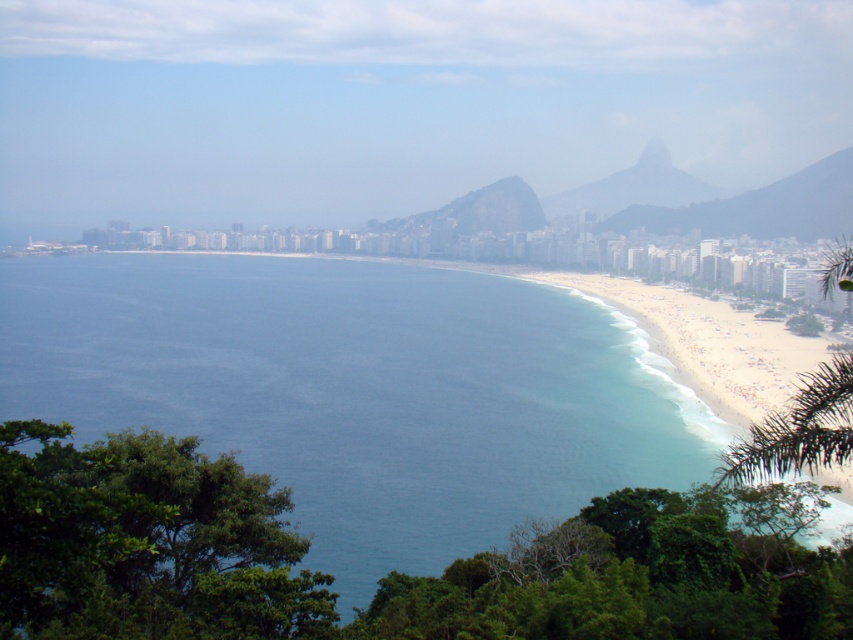
You are a photographer planning to capture the entire coastal cityscape from this vantage point. Considering the blue water at center and the gray rocky mountain at upper right, which object will appear closer to the camera in your photo?

The blue water at center appears closer to the camera because it is positioned in front of the gray rocky mountain at upper right.

You are a drone operator tasked with capturing aerial footage of the coastal cityscape. Your drone has a maximum flight range of 300 feet. Starting from the white sand beach at center, can your drone safely reach the gray rocky mountain at upper right without exceeding its range?

The white sand beach at center is 351.32 feet from the gray rocky mountain at upper right. Since the drone has a maximum range of 300 feet, it cannot safely reach the gray rocky mountain at upper right without exceeding its range.

You are standing at the viewpoint overlooking the coastal city. You notice two points marked on the image. The first point is at coordinates point (x=161, y=310) and the second is at point (x=521, y=225). Based on the scene, which point is closer to you?

Point (x=161, y=310) is closer to you because it is in front of point (x=521, y=225).